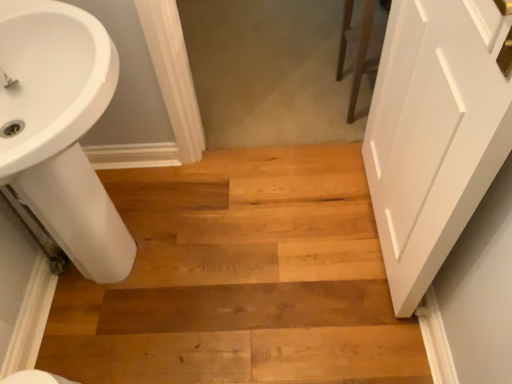
This screenshot has height=384, width=512. I want to click on vacant region to the right of white glossy sink at lower left, so pyautogui.click(x=250, y=258).